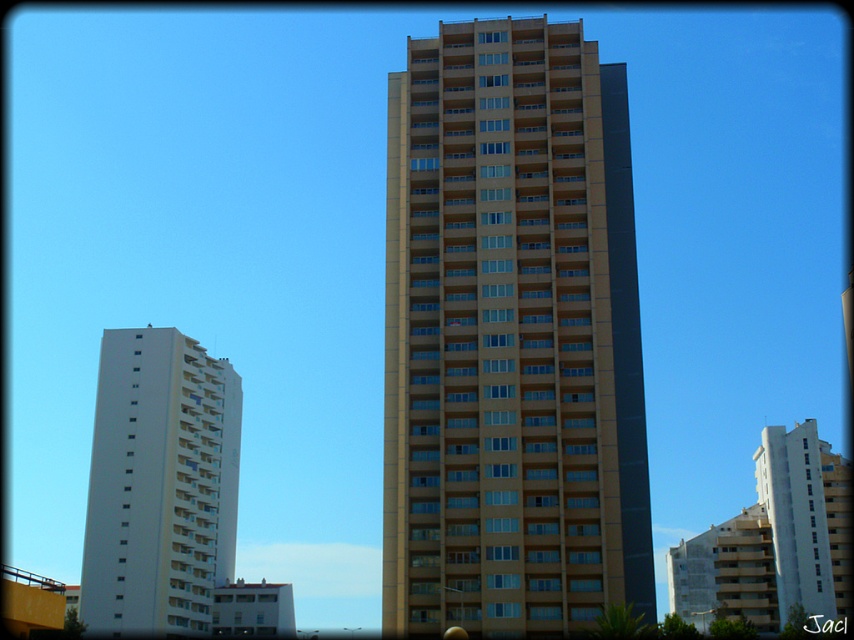
You are standing at the base of the central beige building and want to look towards the right side of the city. There are two points marked in the image, point (x=407, y=371) and point (x=126, y=456). Which point is closer to your line of sight?

Point (x=407, y=371) is in front of point (x=126, y=456), so it is closer to your line of sight.

You are an urban planner reviewing the city layout. You need to determine which building occupies more horizontal space in the image. Based on the beige concrete building at center and the white smooth building at left, which one is wider?

The beige concrete building at center is wider than the white smooth building at left.